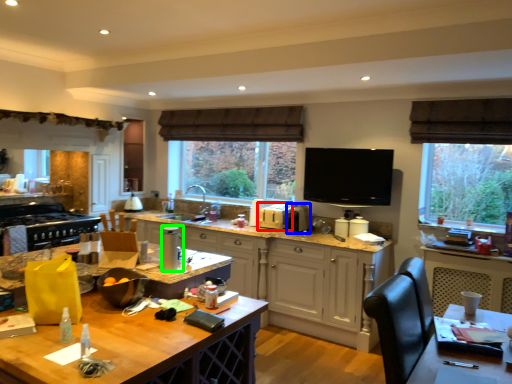
Question: Based on their relative distances, which object is nearer to appliance (highlighted by a red box)? Choose from appliance (highlighted by a blue box) and appliance (highlighted by a green box).

Choices:
 (A) appliance
 (B) appliance

Answer: (A)